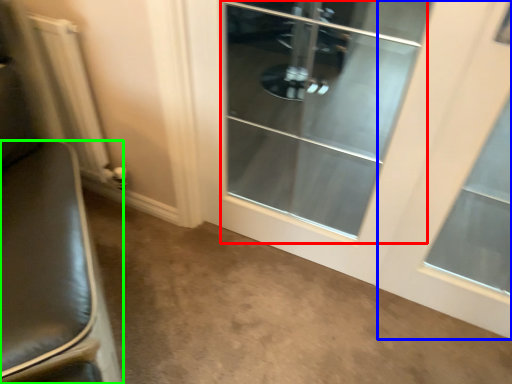
Question: Which object is the farthest from screen door (highlighted by a red box)? Choose among these: window (highlighted by a blue box) or furniture (highlighted by a green box).

Choices:
 (A) window
 (B) furniture

Answer: (B)